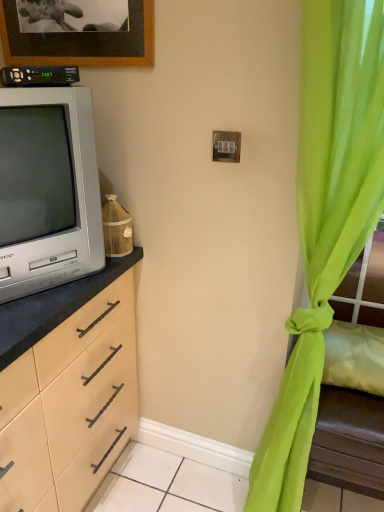
Question: Does black plastic remote control at upper left have a greater height compared to matte gray television at left?

Choices:
 (A) yes
 (B) no

Answer: (B)

Question: Is black plastic remote control at upper left to the left of matte gray television at left from the viewer's perspective?

Choices:
 (A) no
 (B) yes

Answer: (A)

Question: Is black plastic remote control at upper left directly adjacent to matte gray television at left?

Choices:
 (A) no
 (B) yes

Answer: (A)

Question: Considering the relative sizes of black plastic remote control at upper left and matte gray television at left in the image provided, is black plastic remote control at upper left bigger than matte gray television at left?

Choices:
 (A) no
 (B) yes

Answer: (A)

Question: From the image's perspective, is black plastic remote control at upper left located above matte gray television at left?

Choices:
 (A) no
 (B) yes

Answer: (B)

Question: Is black plastic remote control at upper left oriented towards matte gray television at left?

Choices:
 (A) yes
 (B) no

Answer: (A)

Question: Is green sheer curtain at right positioned in front of matte gray television at left?

Choices:
 (A) no
 (B) yes

Answer: (B)

Question: Can you confirm if green sheer curtain at right is wider than matte gray television at left?

Choices:
 (A) no
 (B) yes

Answer: (A)

Question: Is green sheer curtain at right turned away from matte gray television at left?

Choices:
 (A) yes
 (B) no

Answer: (B)

Question: Can you confirm if green sheer curtain at right is shorter than matte gray television at left?

Choices:
 (A) no
 (B) yes

Answer: (A)

Question: Considering the relative positions of green sheer curtain at right and matte gray television at left in the image provided, is green sheer curtain at right behind matte gray television at left?

Choices:
 (A) no
 (B) yes

Answer: (A)

Question: Is the surface of green sheer curtain at right in direct contact with matte gray television at left?

Choices:
 (A) yes
 (B) no

Answer: (B)

Question: Does green sheer curtain at right have a smaller size compared to black plastic remote control at upper left?

Choices:
 (A) yes
 (B) no

Answer: (B)